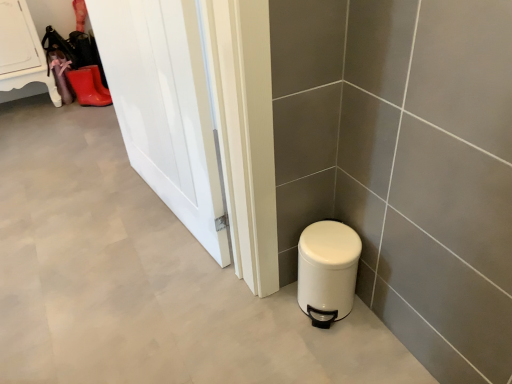
The image size is (512, 384). What are the coordinates of `free spot above white matte trash can at lower right (from a real-world perspective)` in the screenshot? It's located at (328, 240).